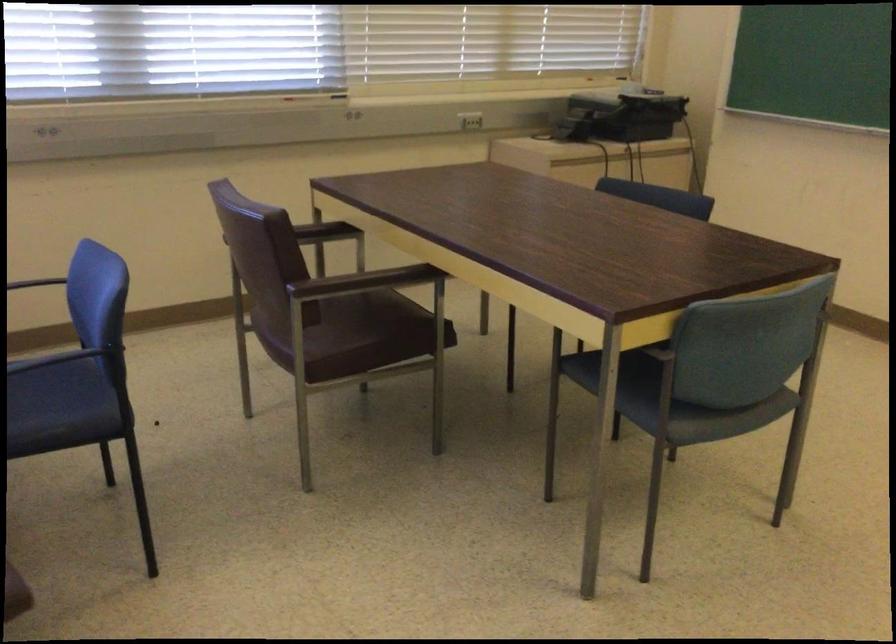
The height and width of the screenshot is (644, 896). In order to click on black chair armrest in this screenshot , I will do `click(39, 283)`.